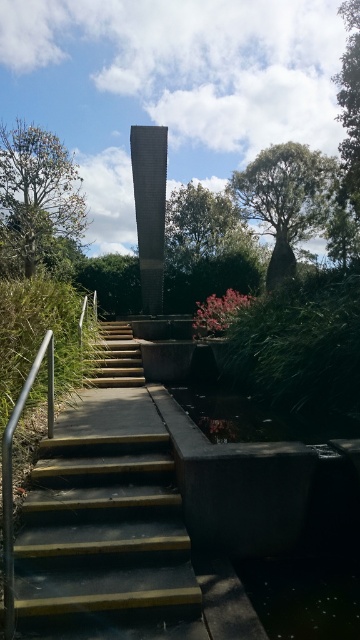
You are a painter who wants to paint the dark gray concrete stairs at center and the polished metal handrail at left. If you have a limited amount of paint, which object requires more paint due to its larger surface area?

The dark gray concrete stairs at center requires more paint because its width is larger than the polished metal handrail at left, resulting in a greater surface area.

You are standing at the base of the structure and want to know how far the polished metal handrail at left is from you. Can you determine the distance?

The polished metal handrail at left is 7.51 feet away from the viewer.

You are a maintenance worker who needs to inspect both the dark gray concrete stairs at center and the yellow wood stairs at center. Given that you can only carry a ladder that is 8 feet long, can you safely move the ladder between these two sets of stairs without needing to adjust its length?

The dark gray concrete stairs at center and yellow wood stairs at center are 8.70 feet apart from each other. Since the ladder is only 8 feet long, it is too short to safely bridge the gap between them. You would need a longer ladder to ensure stability while moving between the two.